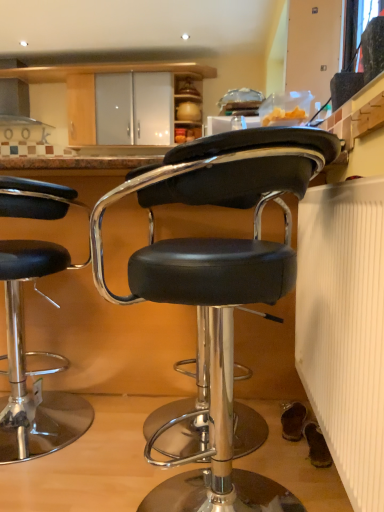
This screenshot has width=384, height=512. Describe the element at coordinates (344, 328) in the screenshot. I see `white ribbed radiator at lower right` at that location.

The image size is (384, 512). What are the coordinates of `black leather stool at center, the second chair positioned from the left` in the screenshot? It's located at (218, 284).

Which of these two, black leather stool at center, the 1th chair from the front, or black leather stool at left, which ranks as the second chair in right-to-left order, is bigger?

black leather stool at center, the 1th chair from the front, is bigger.

From the image's perspective, who appears lower, black leather stool at center, placed as the 1th chair when sorted from right to left, or black leather stool at left, which ranks as the first chair in left-to-right order?

From the image's view, black leather stool at center, placed as the 1th chair when sorted from right to left, is below.

From the picture: Is black leather stool at center, placed as the 2th chair when sorted from back to front, with black leather stool at left, which ranks as the second chair in right-to-left order?

No.

Where is `chair located on the right of black leather stool at left, which appears as the 1th chair when viewed from the back`? chair located on the right of black leather stool at left, which appears as the 1th chair when viewed from the back is located at coordinates (218, 284).

Is point (348, 10) positioned behind point (29, 191)?

Yes, point (348, 10) is farther from viewer.

Which object is thinner, transparent glass window screen at upper right or black leather stool at left, which ranks as the 2th chair in front-to-back order?

Thinner between the two is transparent glass window screen at upper right.

Is transparent glass window screen at upper right far away from black leather stool at left, which ranks as the first chair in left-to-right order?

Indeed, transparent glass window screen at upper right is not near black leather stool at left, which ranks as the first chair in left-to-right order.

Considering the relative sizes of transparent glass window screen at upper right and black leather stool at left, which ranks as the first chair in left-to-right order, in the image provided, is transparent glass window screen at upper right taller than black leather stool at left, which ranks as the first chair in left-to-right order,?

No, transparent glass window screen at upper right is not taller than black leather stool at left, which ranks as the first chair in left-to-right order.

Considering the positions of objects black leather stool at left, which ranks as the first chair in left-to-right order, and black leather stool at center, the 1th chair from the front, in the image provided, who is in front, black leather stool at left, which ranks as the first chair in left-to-right order, or black leather stool at center, the 1th chair from the front,?

black leather stool at center, the 1th chair from the front, is closer to the camera.

Is black leather stool at center, the 1th chair from the front, inside black leather stool at left, which ranks as the second chair in right-to-left order?

No.

Is black leather stool at left, which ranks as the first chair in left-to-right order, smaller than black leather stool at center, placed as the 2th chair when sorted from back to front?

Yes.

Consider the image. Which object is positioned more to the right, black leather stool at center, the 1th chair from the front, or transparent glass window screen at upper right?

Positioned to the right is transparent glass window screen at upper right.

Is black leather stool at center, the second chair positioned from the left, inside the boundaries of transparent glass window screen at upper right, or outside?

black leather stool at center, the second chair positioned from the left, is spatially situated outside transparent glass window screen at upper right.

Can you tell me how much black leather stool at center, placed as the 1th chair when sorted from right to left, and transparent glass window screen at upper right differ in facing direction?

The angular difference between black leather stool at center, placed as the 1th chair when sorted from right to left, and transparent glass window screen at upper right is 91.2 degrees.

Between black leather stool at center, the 1th chair from the front, and transparent glass window screen at upper right, which one has larger size?

black leather stool at center, the 1th chair from the front.

How different are the orientations of transparent glass window screen at upper right and white ribbed radiator at lower right in degrees?

The angular difference between transparent glass window screen at upper right and white ribbed radiator at lower right is 3.36 degrees.

In the scene shown: Is transparent glass window screen at upper right at the left side of white ribbed radiator at lower right?

Incorrect, transparent glass window screen at upper right is not on the left side of white ribbed radiator at lower right.

Is transparent glass window screen at upper right not within white ribbed radiator at lower right?

transparent glass window screen at upper right lies outside white ribbed radiator at lower right's area.

Is black leather stool at left, which appears as the 1th chair when viewed from the back, at the right side of transparent glass window screen at upper right?

No, black leather stool at left, which appears as the 1th chair when viewed from the back, is not to the right of transparent glass window screen at upper right.

From the image's perspective, would you say black leather stool at left, which ranks as the second chair in right-to-left order, is shown under transparent glass window screen at upper right?

Yes.

How different are the orientations of black leather stool at left, which appears as the 1th chair when viewed from the back, and transparent glass window screen at upper right in degrees?

The angle between the facing direction of black leather stool at left, which appears as the 1th chair when viewed from the back, and the facing direction of transparent glass window screen at upper right is 90 degrees.

Is there a large distance between black leather stool at left, which ranks as the second chair in right-to-left order, and transparent glass window screen at upper right?

Indeed, black leather stool at left, which ranks as the second chair in right-to-left order, is not near transparent glass window screen at upper right.

Relative to white ribbed radiator at lower right, is black leather stool at center, the 1th chair from the front, in front or behind?

Visually, black leather stool at center, the 1th chair from the front, is located behind white ribbed radiator at lower right.

Looking at this image, is black leather stool at center, the 1th chair from the front, inside the boundaries of white ribbed radiator at lower right, or outside?

black leather stool at center, the 1th chair from the front, is spatially situated outside white ribbed radiator at lower right.

Which is closer to the camera, (296, 153) or (377, 300)?

Point (296, 153) is positioned farther from the camera compared to point (377, 300).

Can you see black leather stool at center, placed as the 2th chair when sorted from back to front, touching white ribbed radiator at lower right?

No, black leather stool at center, placed as the 2th chair when sorted from back to front, is not next to white ribbed radiator at lower right.

Identify the location of chair to the left of black leather stool at center, placed as the 2th chair when sorted from back to front. (33, 370).

Find the location of a particular element. window screen located in front of the black leather stool at left, which ranks as the 2th chair in front-to-back order is located at coordinates (357, 27).

Considering their positions, is white ribbed radiator at lower right positioned closer to black leather stool at center, the second chair positioned from the left, than black leather stool at left, which appears as the 1th chair when viewed from the back?

Among the two, white ribbed radiator at lower right is located nearer to black leather stool at center, the second chair positioned from the left.

Which object lies further to the anchor point transparent glass window screen at upper right, black leather stool at center, placed as the 2th chair when sorted from back to front, or white ribbed radiator at lower right?

black leather stool at center, placed as the 2th chair when sorted from back to front, lies further to transparent glass window screen at upper right than the other object.

Considering their positions, is black leather stool at center, the 1th chair from the front, positioned closer to white ribbed radiator at lower right than black leather stool at left, which appears as the 1th chair when viewed from the back?

black leather stool at center, the 1th chair from the front, is positioned closer to the anchor white ribbed radiator at lower right.

Considering their positions, is black leather stool at left, which ranks as the second chair in right-to-left order, positioned closer to white ribbed radiator at lower right than black leather stool at center, placed as the 2th chair when sorted from back to front?

Based on the image, black leather stool at center, placed as the 2th chair when sorted from back to front, appears to be nearer to white ribbed radiator at lower right.

Based on their spatial positions, is black leather stool at center, placed as the 2th chair when sorted from back to front, or transparent glass window screen at upper right further from black leather stool at left, which appears as the 1th chair when viewed from the back?

transparent glass window screen at upper right.

Which object lies nearer to the anchor point black leather stool at left, which ranks as the second chair in right-to-left order, black leather stool at center, placed as the 2th chair when sorted from back to front, or white ribbed radiator at lower right?

black leather stool at center, placed as the 2th chair when sorted from back to front.

In the scene shown: Based on their spatial positions, is white ribbed radiator at lower right or transparent glass window screen at upper right further from black leather stool at left, which ranks as the 2th chair in front-to-back order?

transparent glass window screen at upper right is positioned further to the anchor black leather stool at left, which ranks as the 2th chair in front-to-back order.

From the image, which object appears to be farther from white ribbed radiator at lower right, black leather stool at center, placed as the 2th chair when sorted from back to front, or transparent glass window screen at upper right?

The object further to white ribbed radiator at lower right is transparent glass window screen at upper right.

Image resolution: width=384 pixels, height=512 pixels. Find the location of `radiator between transparent glass window screen at upper right and black leather stool at center, the 1th chair from the front, vertically`. radiator between transparent glass window screen at upper right and black leather stool at center, the 1th chair from the front, vertically is located at coordinates (344, 328).

This screenshot has height=512, width=384. Identify the location of radiator located between black leather stool at left, which ranks as the 2th chair in front-to-back order, and transparent glass window screen at upper right in the left-right direction. (344, 328).

Where is `chair between black leather stool at left, which ranks as the second chair in right-to-left order, and transparent glass window screen at upper right from left to right`? The image size is (384, 512). chair between black leather stool at left, which ranks as the second chair in right-to-left order, and transparent glass window screen at upper right from left to right is located at coordinates (218, 284).

Locate an element on the screen. Image resolution: width=384 pixels, height=512 pixels. chair located between black leather stool at left, which ranks as the second chair in right-to-left order, and white ribbed radiator at lower right in the left-right direction is located at coordinates (218, 284).